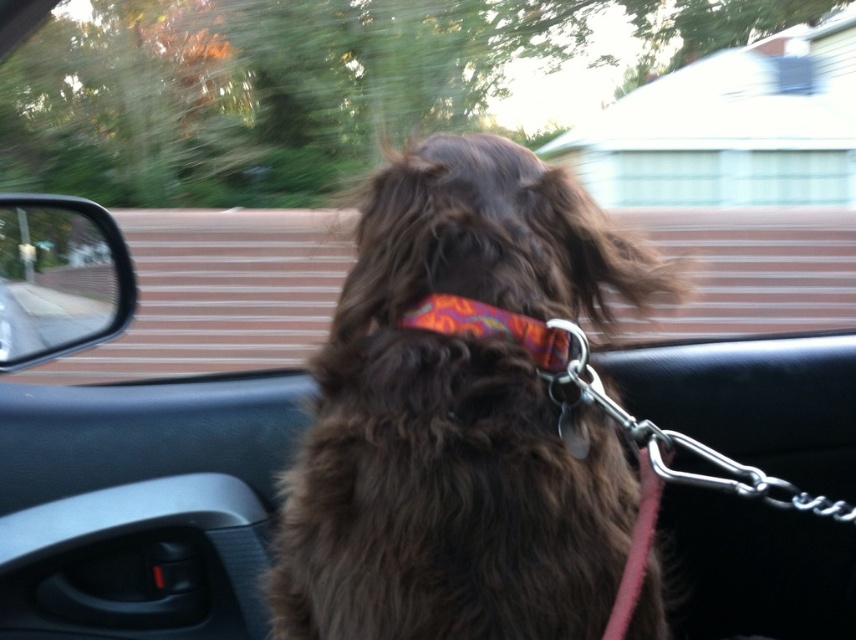
You are a passenger in the car and want to see the multicolored fabric neckband at center through the clear glass window at upper left. Is it possible to see it through the window?

→ The multicolored fabric neckband at center is behind the clear glass window at upper left, so it is possible to see it through the window since the window is clear.

You are a passenger in the car and notice the brown furry dog at center and the multicolored fabric neckband at center. Which object is nearer to your eyes?

The brown furry dog at center is closer to the viewer than the multicolored fabric neckband at center.

You are a passenger in the car and want to know which of the two points, point (596, 586) or point (111, 236), is closer to you. Based on the scene description, which point is closer?

Point (596, 586) is closer to the viewer than point (111, 236).